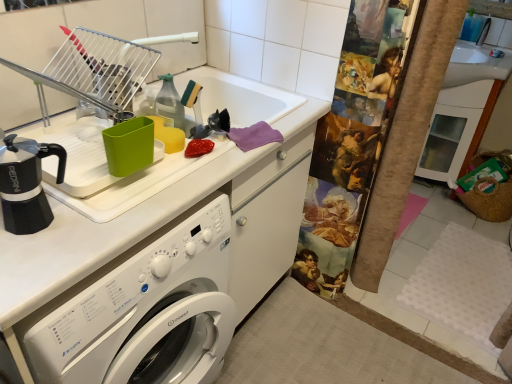
You are a GUI agent. You are given a task and a screenshot of the screen. Output one action in this format:
    pyautogui.click(x=<x>, y=<y>)
    Task: Click on the black matte coffee pot at left
    This screenshot has height=384, width=512.
    Given the screenshot: What is the action you would take?
    pyautogui.click(x=26, y=184)

Which of these two, brushed metal faucet at upper center or white glossy washing machine at center, stands taller?

With more height is white glossy washing machine at center.

From a real-world perspective, is brushed metal faucet at upper center positioned above or below white glossy washing machine at center?

brushed metal faucet at upper center is above white glossy washing machine at center.

Between brushed metal faucet at upper center and white glossy washing machine at center, which one is positioned in front?

white glossy washing machine at center is in front.

Would you say brushed metal faucet at upper center is to the left or to the right of white glossy washing machine at center in the picture?

From the image, it's evident that brushed metal faucet at upper center is to the right of white glossy washing machine at center.

Where is `coffeepot above the white glossy washing machine at center (from the image's perspective)`? coffeepot above the white glossy washing machine at center (from the image's perspective) is located at coordinates (26, 184).

Which object is positioned more to the right, white glossy washing machine at center or black matte coffee pot at left?

white glossy washing machine at center.

Based on the photo, from a real-world perspective, which is physically above, white glossy washing machine at center or black matte coffee pot at left?

black matte coffee pot at left, from a real-world perspective.

From the image's perspective, which is above, brushed metal faucet at upper center or black matte coffee pot at left?

brushed metal faucet at upper center appears higher in the image.

Is brushed metal faucet at upper center to the left or to the right of black matte coffee pot at left in the image?

Based on their positions, brushed metal faucet at upper center is located to the right of black matte coffee pot at left.

Is brushed metal faucet at upper center thinner than black matte coffee pot at left?

Correct, the width of brushed metal faucet at upper center is less than that of black matte coffee pot at left.

How different are the orientations of metallic silver dish rack at upper left and white glossy washing machine at center in degrees?

They differ by 1.23 degrees in their facing directions.

Could you tell me if metallic silver dish rack at upper left is facing white glossy washing machine at center?

No, metallic silver dish rack at upper left is not turned towards white glossy washing machine at center.

Choose the correct answer: Is metallic silver dish rack at upper left inside white glossy washing machine at center or outside it?

metallic silver dish rack at upper left is spatially situated outside white glossy washing machine at center.

Does metallic silver dish rack at upper left have a larger size compared to black matte coffee pot at left?

Yes.

In the image, is metallic silver dish rack at upper left positioned in front of or behind black matte coffee pot at left?

metallic silver dish rack at upper left is positioned farther from the viewer than black matte coffee pot at left.

Which object is positioned more to the right, metallic silver dish rack at upper left or black matte coffee pot at left?

From the viewer's perspective, metallic silver dish rack at upper left appears more on the right side.

This screenshot has height=384, width=512. What are the coordinates of `coffeepot in front of the metallic silver dish rack at upper left` in the screenshot? It's located at (26, 184).

Considering the relative sizes of white glossy washing machine at center and metallic silver dish rack at upper left in the image provided, is white glossy washing machine at center wider than metallic silver dish rack at upper left?

Yes, white glossy washing machine at center is wider than metallic silver dish rack at upper left.

Which point is more distant from viewer, (164, 295) or (76, 63)?

The point (76, 63) is farther.

From the picture: Is white glossy washing machine at center positioned far away from metallic silver dish rack at upper left?

No, white glossy washing machine at center is not far away from metallic silver dish rack at upper left.

Considering the relative positions of white glossy washing machine at center and metallic silver dish rack at upper left in the image provided, is white glossy washing machine at center to the left of metallic silver dish rack at upper left from the viewer's perspective?

Yes.

Which object is thinner, black matte coffee pot at left or white glossy washing machine at center?

Thinner between the two is black matte coffee pot at left.

Which is correct: black matte coffee pot at left is inside white glossy washing machine at center, or outside of it?

black matte coffee pot at left is not inside white glossy washing machine at center, it's outside.

Considering the sizes of objects black matte coffee pot at left and white glossy washing machine at center in the image provided, who is bigger, black matte coffee pot at left or white glossy washing machine at center?

white glossy washing machine at center.

Considering the relative positions of black matte coffee pot at left and white glossy washing machine at center in the image provided, is black matte coffee pot at left to the left of white glossy washing machine at center from the viewer's perspective?

Indeed, black matte coffee pot at left is positioned on the left side of white glossy washing machine at center.

What are the coordinates of `washing machine in front of the brushed metal faucet at upper center` in the screenshot? It's located at (143, 310).

The width and height of the screenshot is (512, 384). What are the coordinates of `washing machine located on the right of black matte coffee pot at left` in the screenshot? It's located at (143, 310).

From the image, which object appears to be farther from black matte coffee pot at left, metallic silver dish rack at upper left or white glossy washing machine at center?

white glossy washing machine at center is positioned further to the anchor black matte coffee pot at left.

Estimate the real-world distances between objects in this image. Which object is further from white glossy washing machine at center, metallic silver dish rack at upper left or black matte coffee pot at left?

Based on the image, metallic silver dish rack at upper left appears to be further to white glossy washing machine at center.

Which object lies further to the anchor point white glossy washing machine at center, brushed metal faucet at upper center or metallic silver dish rack at upper left?

brushed metal faucet at upper center.

In the scene shown: Looking at the image, which one is located further to metallic silver dish rack at upper left, white glossy washing machine at center or black matte coffee pot at left?

white glossy washing machine at center lies further to metallic silver dish rack at upper left than the other object.

Considering their positions, is white glossy washing machine at center positioned closer to black matte coffee pot at left than metallic silver dish rack at upper left?

metallic silver dish rack at upper left is positioned closer to the anchor black matte coffee pot at left.

Based on their spatial positions, is white glossy washing machine at center or metallic silver dish rack at upper left closer to brushed metal faucet at upper center?

metallic silver dish rack at upper left is closer to brushed metal faucet at upper center.

Estimate the real-world distances between objects in this image. Which object is further from white glossy washing machine at center, metallic silver dish rack at upper left or brushed metal faucet at upper center?

Among the two, brushed metal faucet at upper center is located further to white glossy washing machine at center.

From the image, which object appears to be farther from brushed metal faucet at upper center, black matte coffee pot at left or metallic silver dish rack at upper left?

black matte coffee pot at left is positioned further to the anchor brushed metal faucet at upper center.

Identify the location of appliance between white glossy washing machine at center and brushed metal faucet at upper center. (101, 68).

What are the coordinates of `coffeepot between metallic silver dish rack at upper left and white glossy washing machine at center in the up-down direction` in the screenshot? It's located at (26, 184).

You are a GUI agent. You are given a task and a screenshot of the screen. Output one action in this format:
    pyautogui.click(x=<x>, y=<y>)
    Task: Click on the appliance between black matte coffee pot at left and brushed metal faucet at upper center
    Image resolution: width=512 pixels, height=384 pixels.
    Given the screenshot: What is the action you would take?
    click(x=101, y=68)

Image resolution: width=512 pixels, height=384 pixels. Identify the location of washing machine located between black matte coffee pot at left and brushed metal faucet at upper center in the left-right direction. (143, 310).